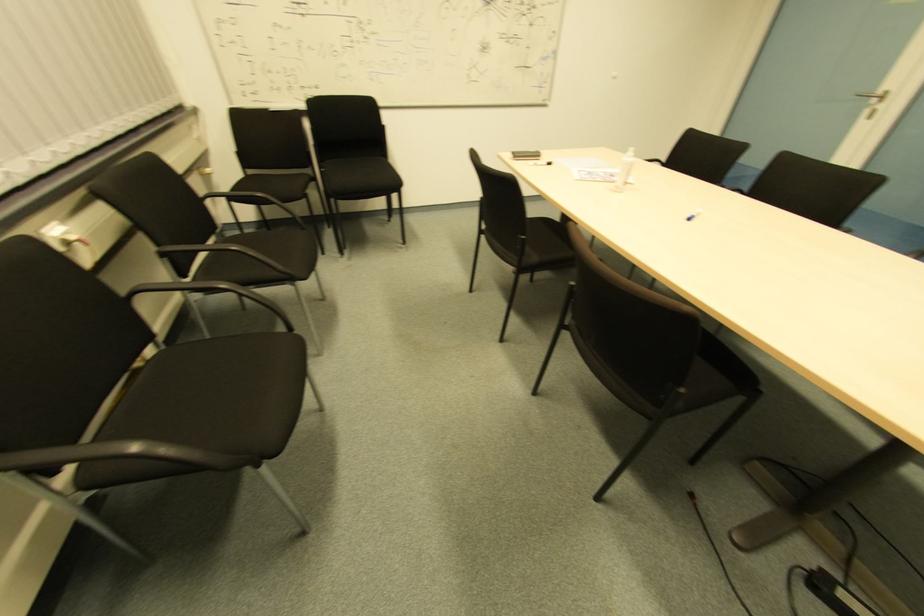
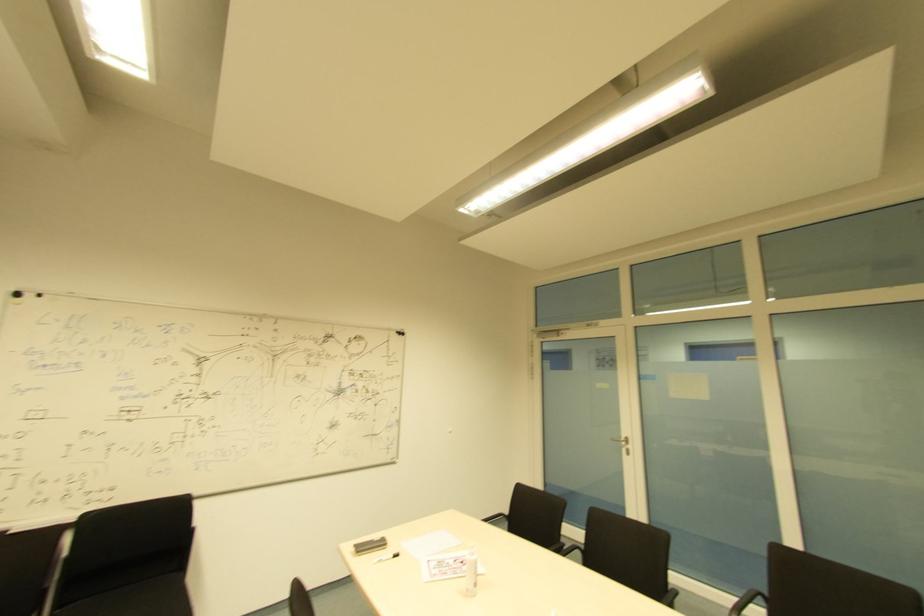
The point at (881, 108) is marked in the first image. Where is the corresponding point in the second image?

(628, 450)